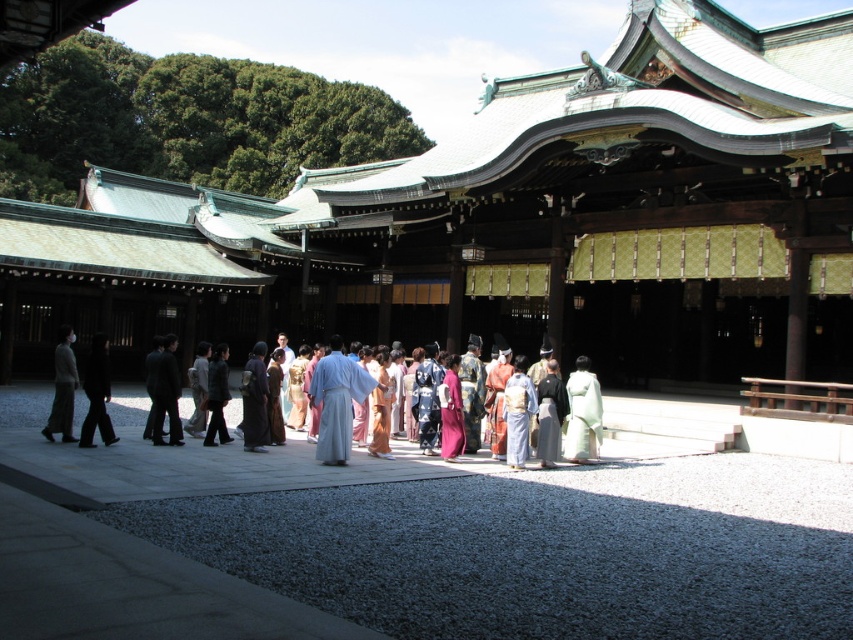
Question: Is white silk kimono at center bigger than light brown wool sweater at left?

Choices:
 (A) yes
 (B) no

Answer: (B)

Question: Which object appears closest to the camera in this image?

Choices:
 (A) white silk kimono at center
 (B) light brown wool sweater at left
 (C) silk kimono at center

Answer: (C)

Question: Can you confirm if silk kimono at center is positioned to the left of white silk kimono at center?

Choices:
 (A) no
 (B) yes

Answer: (B)

Question: Among these objects, which one is farthest from the camera?

Choices:
 (A) light brown wool sweater at left
 (B) light blue silk robe at center

Answer: (A)

Question: Which of the following is the farthest from the observer?

Choices:
 (A) (85, 388)
 (B) (57, 365)
 (C) (276, 416)
 (D) (311, 387)

Answer: (C)

Question: Observing the image, what is the correct spatial positioning of silk kimono at center in reference to light brown wool sweater at left?

Choices:
 (A) right
 (B) left

Answer: (A)